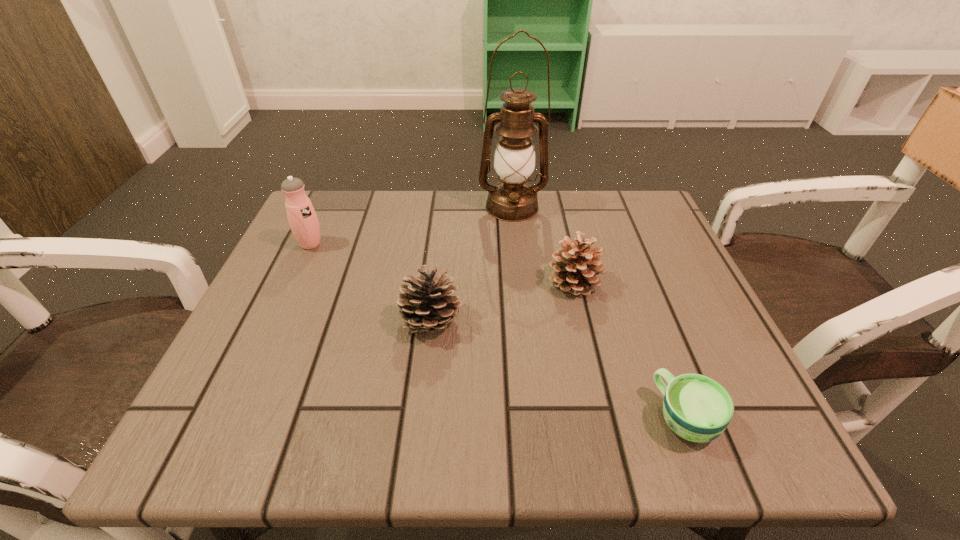
You are a GUI agent. You are given a task and a screenshot of the screen. Output one action in this format:
    pyautogui.click(x=<x>, y=<y>)
    Task: Click on the vacant point located 0.290m on the back of the left pinecone
    
    Given the screenshot: What is the action you would take?
    pyautogui.click(x=444, y=214)

I want to click on vacant space located on the right of the right pinecone, so click(697, 282).

In order to click on vacant region located on the left of the nearest object in this screenshot , I will do click(482, 417).

Identify the location of oil lamp at the far edge. The width and height of the screenshot is (960, 540). (512, 199).

Where is `thermos bottle that is at the far edge`? This screenshot has width=960, height=540. thermos bottle that is at the far edge is located at coordinates (302, 218).

Identify the location of object that is at the near edge. The image size is (960, 540). (697, 408).

This screenshot has height=540, width=960. Find the location of `object located in the left edge section of the desktop`. object located in the left edge section of the desktop is located at coordinates (302, 218).

At what (x,y) coordinates should I click in order to perform the action: click on object situated at the right edge. Please return your answer as a coordinate pair (x, y). The width and height of the screenshot is (960, 540). Looking at the image, I should click on (697, 408).

Locate an element on the screen. The image size is (960, 540). object at the far left corner is located at coordinates 302,218.

Locate an element on the screen. The width and height of the screenshot is (960, 540). object that is at the near right corner is located at coordinates (697, 408).